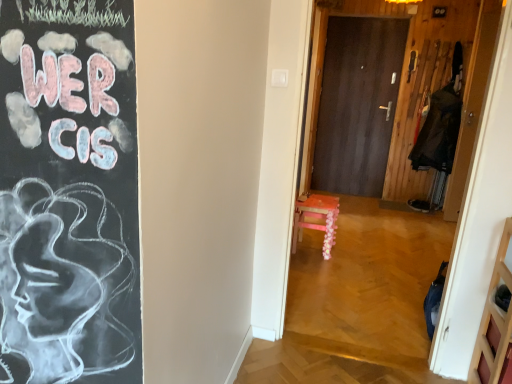
Question: Is dark wood door at center, positioned as the 1th door in back-to-front order, taller than wooden floral-patterned stool at center?

Choices:
 (A) yes
 (B) no

Answer: (A)

Question: Could you tell me if dark wood door at center, positioned as the 1th door in back-to-front order, is turned towards wooden floral-patterned stool at center?

Choices:
 (A) yes
 (B) no

Answer: (A)

Question: From a real-world perspective, is dark wood door at center, positioned as the 1th door in back-to-front order, positioned under wooden floral-patterned stool at center based on gravity?

Choices:
 (A) no
 (B) yes

Answer: (A)

Question: Does dark wood door at center, positioned as the second door in right-to-left order, have a lesser width compared to wooden floral-patterned stool at center?

Choices:
 (A) no
 (B) yes

Answer: (B)

Question: From a real-world perspective, is dark wood door at center, positioned as the 1th door in back-to-front order, on wooden floral-patterned stool at center?

Choices:
 (A) yes
 (B) no

Answer: (A)

Question: Is the surface of dark wood door at center, positioned as the 1th door in back-to-front order, in direct contact with wooden floral-patterned stool at center?

Choices:
 (A) no
 (B) yes

Answer: (A)

Question: From a real-world perspective, is wooden floral-patterned stool at center physically below wooden door at right, which is the 1th door from right to left?

Choices:
 (A) no
 (B) yes

Answer: (B)

Question: Considering the relative positions of wooden floral-patterned stool at center and wooden door at right, which is the 1th door from right to left, in the image provided, is wooden floral-patterned stool at center in front of wooden door at right, which is the 1th door from right to left,?

Choices:
 (A) yes
 (B) no

Answer: (A)

Question: Is wooden floral-patterned stool at center facing towards wooden door at right, placed as the second door when sorted from left to right?

Choices:
 (A) no
 (B) yes

Answer: (A)

Question: Considering the relative sizes of wooden floral-patterned stool at center and wooden door at right, placed as the second door when sorted from left to right, in the image provided, is wooden floral-patterned stool at center thinner than wooden door at right, placed as the second door when sorted from left to right,?

Choices:
 (A) yes
 (B) no

Answer: (B)

Question: Is wooden floral-patterned stool at center surrounding wooden door at right, which is counted as the first door, starting from the front?

Choices:
 (A) no
 (B) yes

Answer: (A)

Question: Is wooden floral-patterned stool at center located outside wooden door at right, which is counted as the first door, starting from the front?

Choices:
 (A) no
 (B) yes

Answer: (B)

Question: Are wooden door at right, which is the 1th door from right to left, and dark blue fabric coat at right beside each other?

Choices:
 (A) no
 (B) yes

Answer: (A)